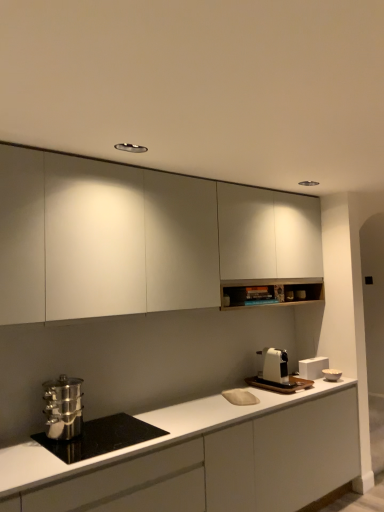
Question: Is stainless steel steamer at lower left, the 1th kitchen appliance in the left-to-right sequence, taller than stainless steel pot at lower left?

Choices:
 (A) no
 (B) yes

Answer: (B)

Question: From the image's perspective, is stainless steel steamer at lower left, acting as the second kitchen appliance starting from the back, located above stainless steel pot at lower left?

Choices:
 (A) yes
 (B) no

Answer: (A)

Question: Are stainless steel steamer at lower left, acting as the second kitchen appliance starting from the back, and stainless steel pot at lower left far apart?

Choices:
 (A) no
 (B) yes

Answer: (A)

Question: Considering the relative sizes of stainless steel steamer at lower left, placed as the 1th kitchen appliance when sorted from front to back, and stainless steel pot at lower left in the image provided, is stainless steel steamer at lower left, placed as the 1th kitchen appliance when sorted from front to back, thinner than stainless steel pot at lower left?

Choices:
 (A) yes
 (B) no

Answer: (A)

Question: From a real-world perspective, is stainless steel steamer at lower left, the 2th kitchen appliance in the right-to-left sequence, on stainless steel pot at lower left?

Choices:
 (A) no
 (B) yes

Answer: (B)

Question: Is stainless steel steamer at lower left, placed as the 1th kitchen appliance when sorted from front to back, facing away from stainless steel pot at lower left?

Choices:
 (A) no
 (B) yes

Answer: (A)

Question: Is stainless steel pot at lower left further to camera compared to white glossy bowl at right, the 1th appliance viewed from the right?

Choices:
 (A) no
 (B) yes

Answer: (A)

Question: Is white glossy bowl at right, which ranks as the second appliance in left-to-right order, surrounded by stainless steel pot at lower left?

Choices:
 (A) no
 (B) yes

Answer: (A)

Question: Could you tell me if stainless steel pot at lower left is facing white glossy bowl at right, which ranks as the second appliance in left-to-right order?

Choices:
 (A) no
 (B) yes

Answer: (A)

Question: From the image's perspective, is stainless steel pot at lower left above white glossy bowl at right, which ranks as the second appliance in left-to-right order?

Choices:
 (A) yes
 (B) no

Answer: (B)

Question: Is stainless steel pot at lower left not inside white glossy bowl at right, which ranks as the second appliance in left-to-right order?

Choices:
 (A) no
 (B) yes

Answer: (B)

Question: Can you see stainless steel pot at lower left touching white glossy bowl at right, which ranks as the second appliance in left-to-right order?

Choices:
 (A) no
 (B) yes

Answer: (A)

Question: Does stainless steel steamer at lower left, the 2th kitchen appliance in the right-to-left sequence, have a greater width compared to white matte cabinet at upper center, which is counted as the second cabinetry, starting from the bottom?

Choices:
 (A) no
 (B) yes

Answer: (A)